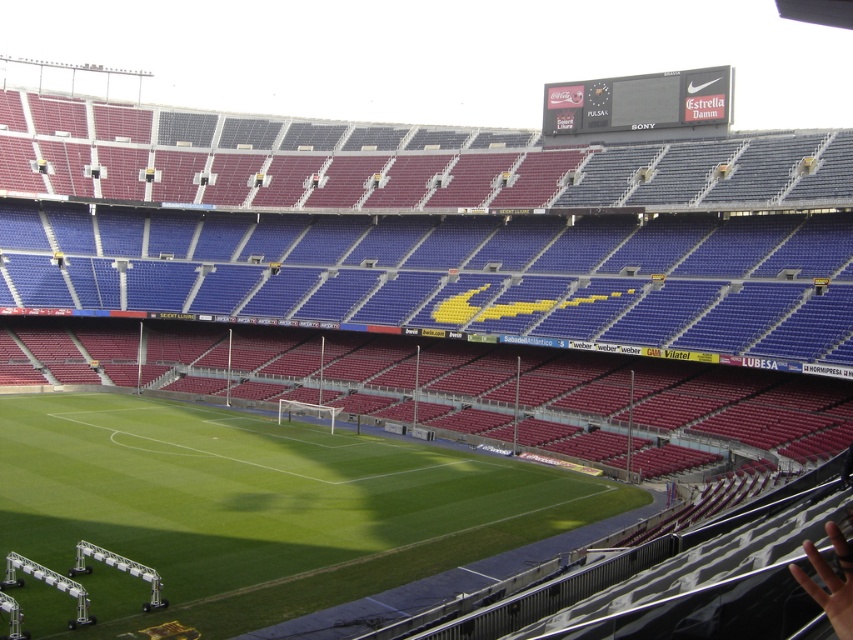
You are a photographer trying to capture a wide shot of the football stadium. You notice a skinny hand at lower right and metallic silver stadium lights at lower left in your frame. Which object should you adjust your camera to focus on to ensure both are in the frame without cropping?

The skinny hand at lower right is smaller than the metallic silver stadium lights at lower left, so you should focus on the metallic silver stadium lights at lower left as they are larger and might require more space in the frame.

You are a photographer standing at the edge of the football field. You notice a skinny hand at lower right and a white metallic goalpost at center. Which object is positioned higher in the image?

The skinny hand at lower right is located above the white metallic goalpost at center, so it is positioned higher in the image.

You are an athlete preparing for a race and see the skinny hand at lower right and the white metallic track at lower left. Which object is smaller in size?

The skinny hand at lower right is smaller in size compared to the white metallic track at lower left.